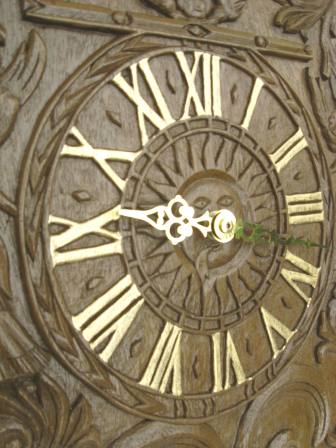
I want to click on clock, so click(208, 252).